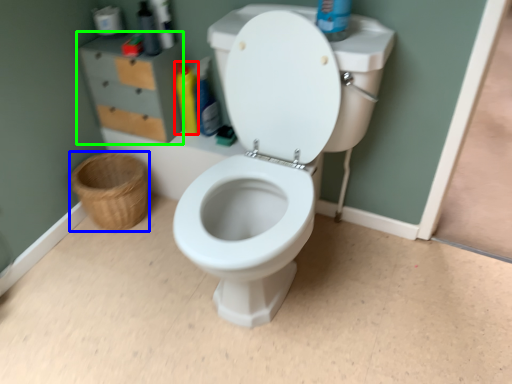
Question: Considering the real-world distances, which object is farthest from cleaning product (highlighted by a red box)? basket (highlighted by a blue box) or file cabinet (highlighted by a green box)?

Choices:
 (A) basket
 (B) file cabinet

Answer: (A)